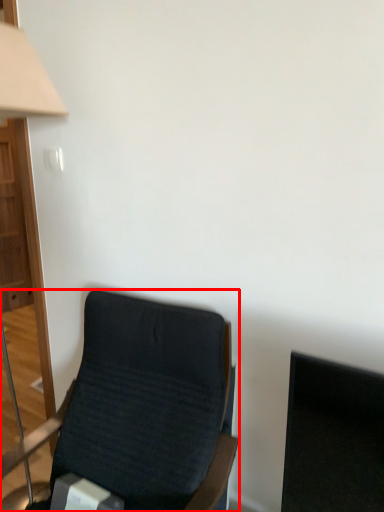
Question: Considering the relative positions of chair (annotated by the red box) and table lamp in the image provided, where is chair (annotated by the red box) located with respect to the staircase?

Choices:
 (A) left
 (B) right

Answer: (B)